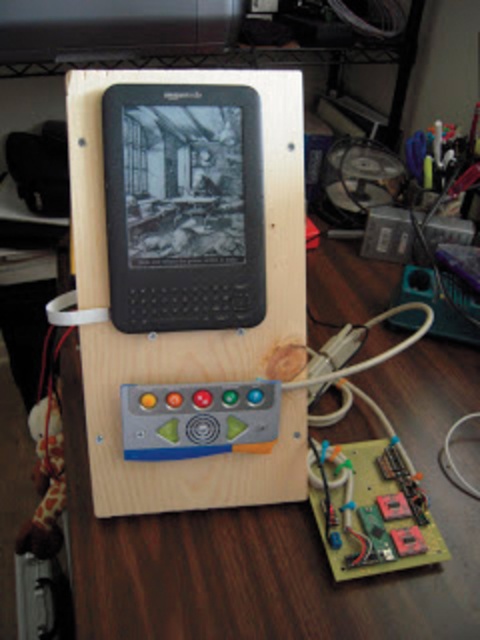
Based on the photo, is wooden at center to the right of black matte e-reader at center from the viewer's perspective?

Indeed, wooden at center is positioned on the right side of black matte e-reader at center.

Who is shorter, wooden at center or black matte e-reader at center?

black matte e-reader at center

Does point (113, 524) lie in front of point (214, 232)?

That is False.

I want to click on wooden at center, so click(279, 538).

I want to click on wooden at center, so click(x=279, y=538).

From the picture: Who is taller, wooden at center or green circuit board at center?

wooden at center

Who is more forward, (262, 580) or (385, 490)?

Positioned in front is point (262, 580).

Locate an element on the screen. This screenshot has width=480, height=640. wooden at center is located at coordinates click(279, 538).

Can you confirm if black matte e-reader at center is bigger than green circuit board at center?

Actually, black matte e-reader at center might be smaller than green circuit board at center.

Between black matte e-reader at center and green circuit board at center, which one has less height?

With less height is green circuit board at center.

Does point (183, 164) lie in front of point (444, 541)?

That is True.

Identify the location of black matte e-reader at center. (183, 205).